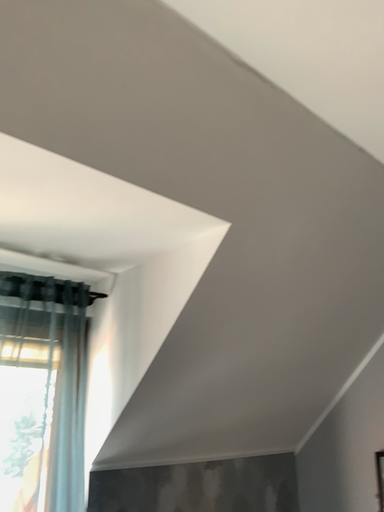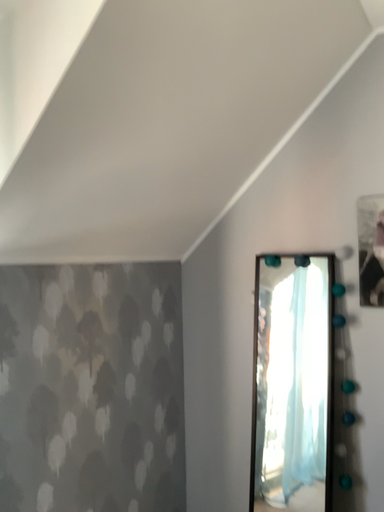
Question: Which way did the camera rotate in the video?

Choices:
 (A) rotated downward
 (B) rotated upward

Answer: (A)